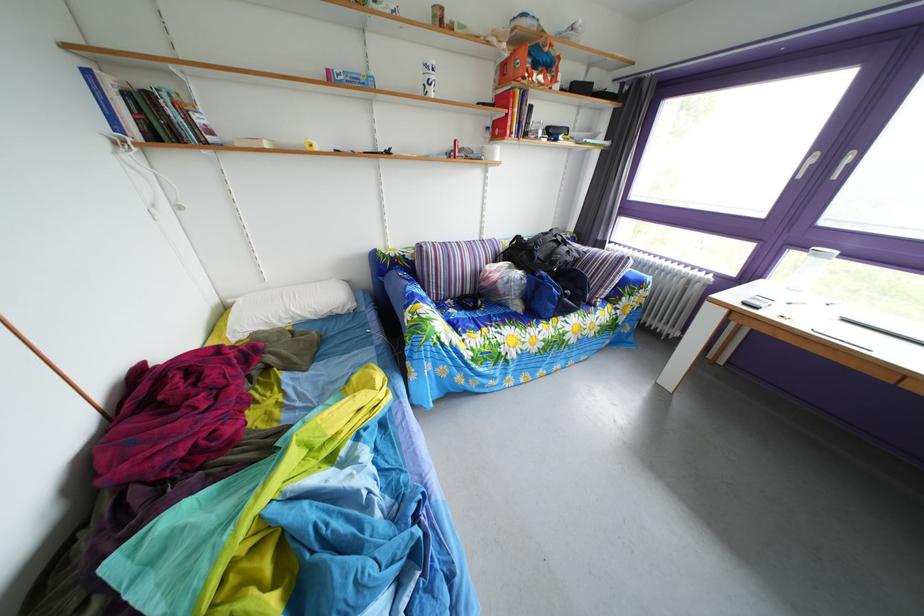
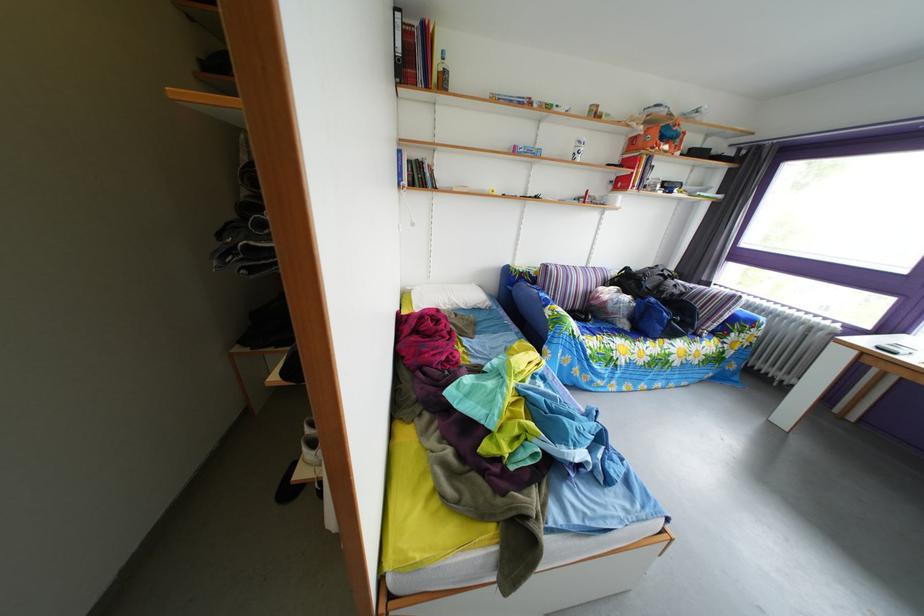
Question: I am providing you with two images of the same scene from different viewpoints. After the viewpoint changes to image2, which objects are now occluded?

Choices:
 (A) blue bag
 (B) white cup
 (C) orange box
 (D) none of these

Answer: (D)